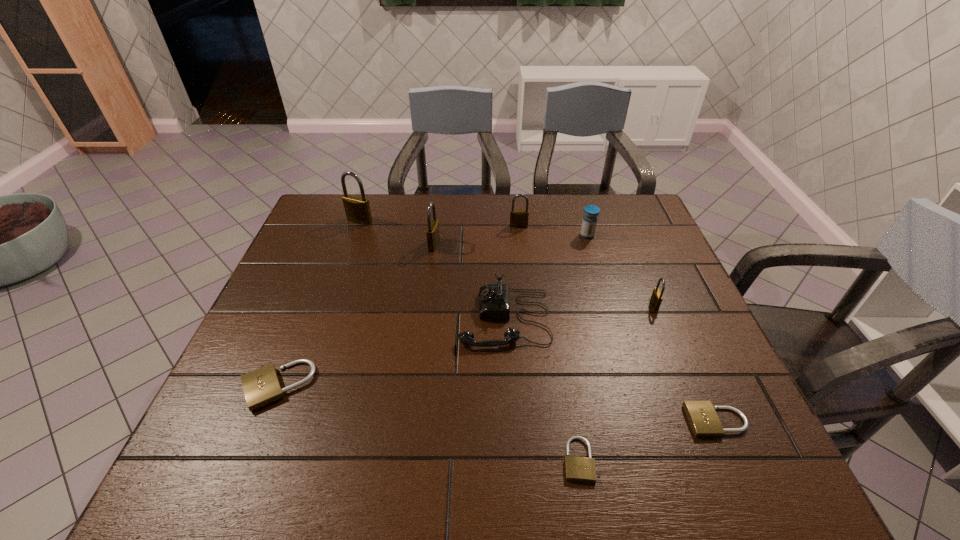
You are a GUI agent. You are given a task and a screenshot of the screen. Output one action in this format:
    pyautogui.click(x=<x>, y=<y>)
    Task: Click on the vacant space located on the left of the blue medicine
    
    Given the screenshot: What is the action you would take?
    pyautogui.click(x=472, y=235)

You are a GUI agent. You are given a task and a screenshot of the screen. Output one action in this format:
    pyautogui.click(x=<x>, y=<y>)
    Task: Click on the free space located 0.130m on the left of the rightmost brass padlock
    This screenshot has height=540, width=960.
    Given the screenshot: What is the action you would take?
    pyautogui.click(x=602, y=305)

Locate an element on the screen. The height and width of the screenshot is (540, 960). free space located on the dial of the telephone is located at coordinates (397, 318).

The image size is (960, 540). Identify the location of free space located on the dial of the telephone. (347, 318).

Where is `vacant position located 0.130m on the dial of the telephone`? This screenshot has width=960, height=540. vacant position located 0.130m on the dial of the telephone is located at coordinates (409, 318).

At what (x,y) coordinates should I click in order to perform the action: click on free space located 0.120m on the front of the third shortest object. Please return your answer as a coordinate pair (x, y). Image resolution: width=960 pixels, height=540 pixels. Looking at the image, I should click on (243, 469).

This screenshot has height=540, width=960. I want to click on free space located on the back of the second shortest padlock, so click(x=701, y=385).

At what (x,y) coordinates should I click in order to perform the action: click on free space located 0.060m on the left of the shortest object. Please return your answer as a coordinate pair (x, y). The height and width of the screenshot is (540, 960). Looking at the image, I should click on (532, 460).

Locate an element on the screen. This screenshot has width=960, height=540. medicine present at the far edge is located at coordinates (589, 222).

You are a GUI agent. You are given a task and a screenshot of the screen. Output one action in this format:
    pyautogui.click(x=<x>, y=<y>)
    Task: Click on the object present at the near edge
    This screenshot has height=540, width=960.
    Given the screenshot: What is the action you would take?
    pyautogui.click(x=580, y=469)